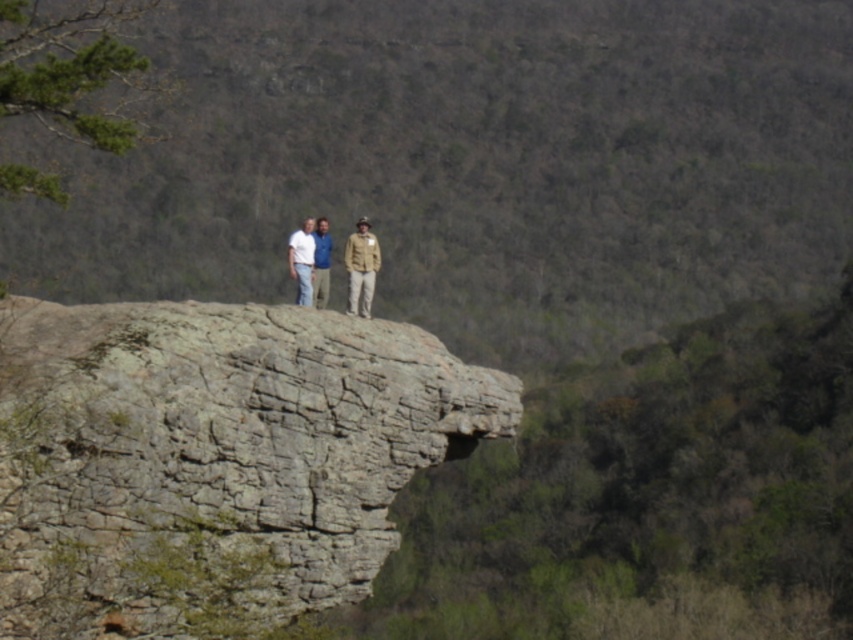
Identify the location of gray rough rock at center. (215, 461).

Is gray rough rock at center further to camera compared to white cotton shirt at center?

No, it is not.

This screenshot has height=640, width=853. In order to click on gray rough rock at center in this screenshot , I will do `click(215, 461)`.

Which is in front, point (370, 262) or point (305, 220)?

Positioned in front is point (370, 262).

Looking at this image, who is more distant from viewer, (352, 300) or (306, 259)?

The point (306, 259) is behind.

Image resolution: width=853 pixels, height=640 pixels. I want to click on khaki fabric jacket at center, so click(x=361, y=268).

Between gray rock formation at center and khaki cotton pants at center, which one is positioned higher?

gray rock formation at center is higher up.

From the picture: Does gray rock formation at center appear on the left side of khaki cotton pants at center?

In fact, gray rock formation at center is to the right of khaki cotton pants at center.

Is point (386, 147) more distant than point (376, 268)?

Yes, it is behind point (376, 268).

Where is `gray rock formation at center`? This screenshot has width=853, height=640. gray rock formation at center is located at coordinates (469, 164).